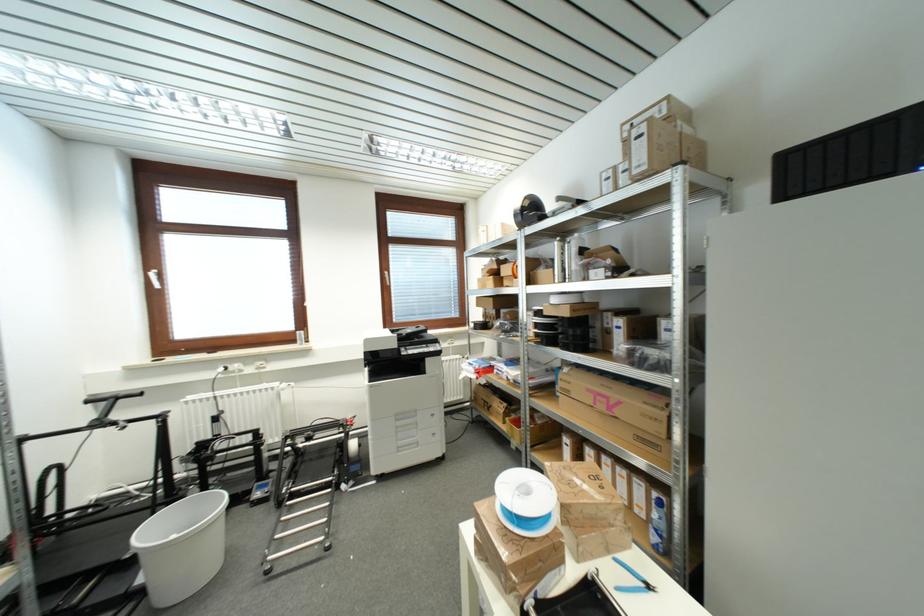
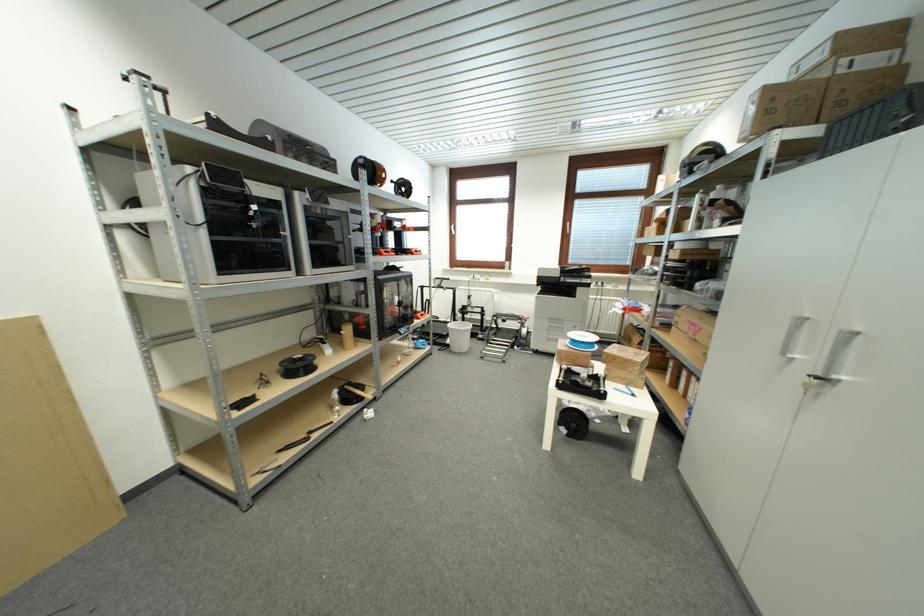
Find the pixel in the second image that matches point (605, 408) in the first image.

(696, 334)